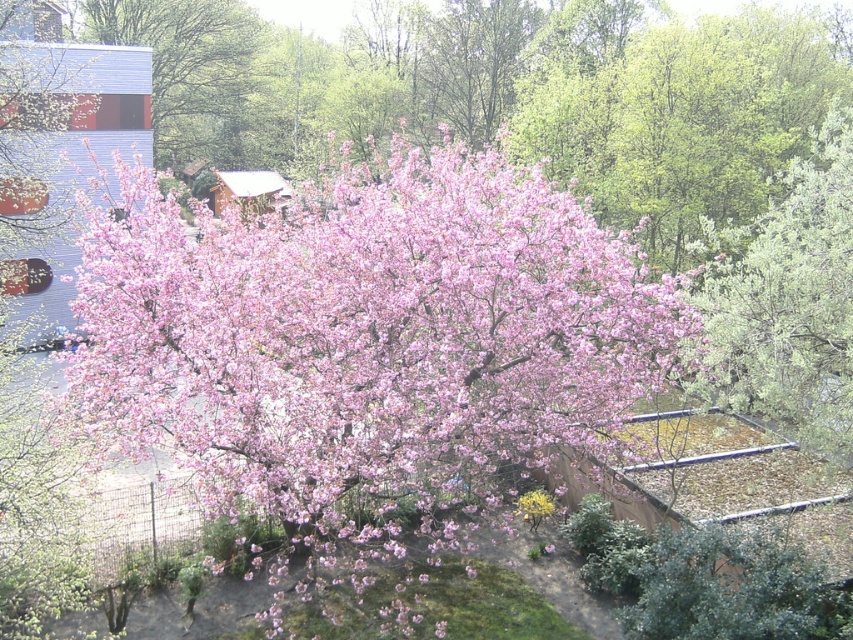
Does pink matte tree at center appear on the right side of pink matte tree at upper left?

Correct, you'll find pink matte tree at center to the right of pink matte tree at upper left.

Can you confirm if pink matte tree at center is shorter than pink matte tree at upper left?

Incorrect, pink matte tree at center's height does not fall short of pink matte tree at upper left's.

The image size is (853, 640). What do you see at coordinates (367, 339) in the screenshot? I see `pink matte tree at center` at bounding box center [367, 339].

At what (x,y) coordinates should I click in order to perform the action: click on pink matte tree at center. Please return your answer as a coordinate pair (x, y). The image size is (853, 640). Looking at the image, I should click on (367, 339).